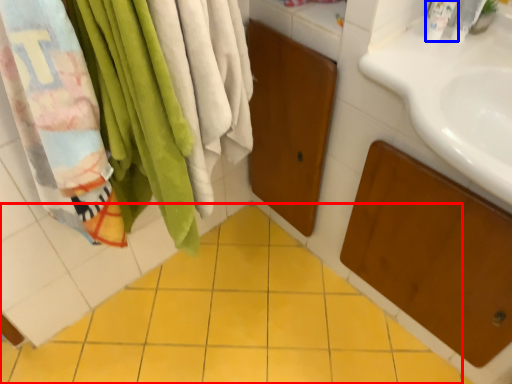
Question: Among these objects, which one is farthest to the camera, ceramic tile (highlighted by a red box) or toiletry (highlighted by a blue box)?

Choices:
 (A) ceramic tile
 (B) toiletry

Answer: (B)